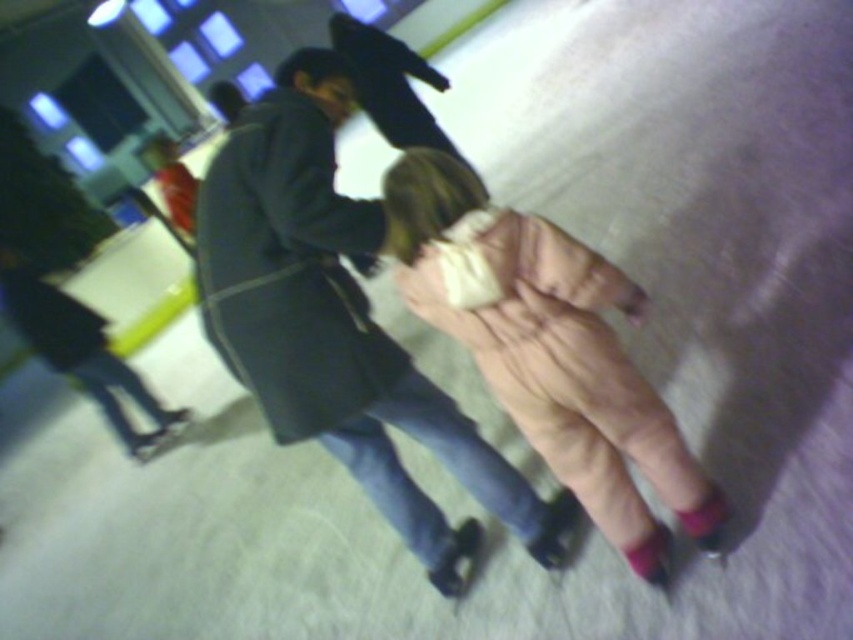
Question: Which point is closer to the camera?

Choices:
 (A) (579, 276)
 (B) (268, 220)

Answer: (A)

Question: Is dark gray coat at center bigger than pink fuzzy coat at center?

Choices:
 (A) no
 (B) yes

Answer: (B)

Question: Can you confirm if dark gray coat at center is positioned to the left of pink fuzzy coat at center?

Choices:
 (A) yes
 (B) no

Answer: (A)

Question: Which object appears farthest from the camera in this image?

Choices:
 (A) pink fuzzy coat at center
 (B) dark gray coat at center

Answer: (B)

Question: Does dark gray coat at center have a lesser width compared to pink fuzzy coat at center?

Choices:
 (A) yes
 (B) no

Answer: (B)